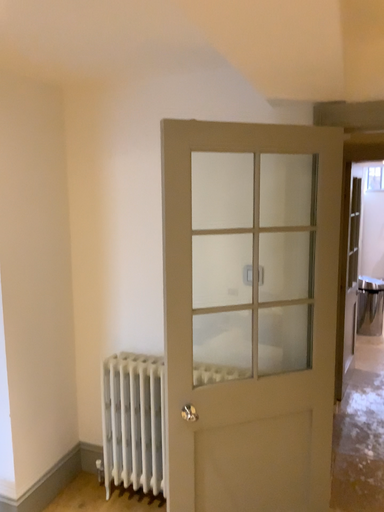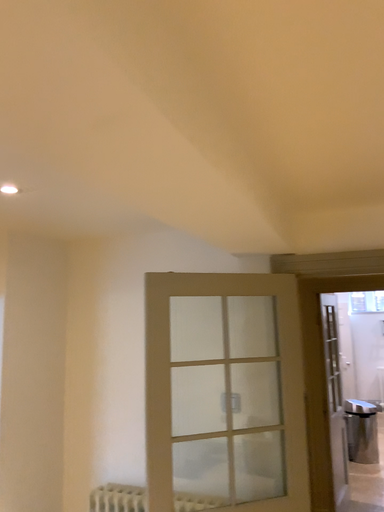
Question: How did the camera likely rotate when shooting the video?

Choices:
 (A) rotated upward
 (B) rotated downward

Answer: (A)